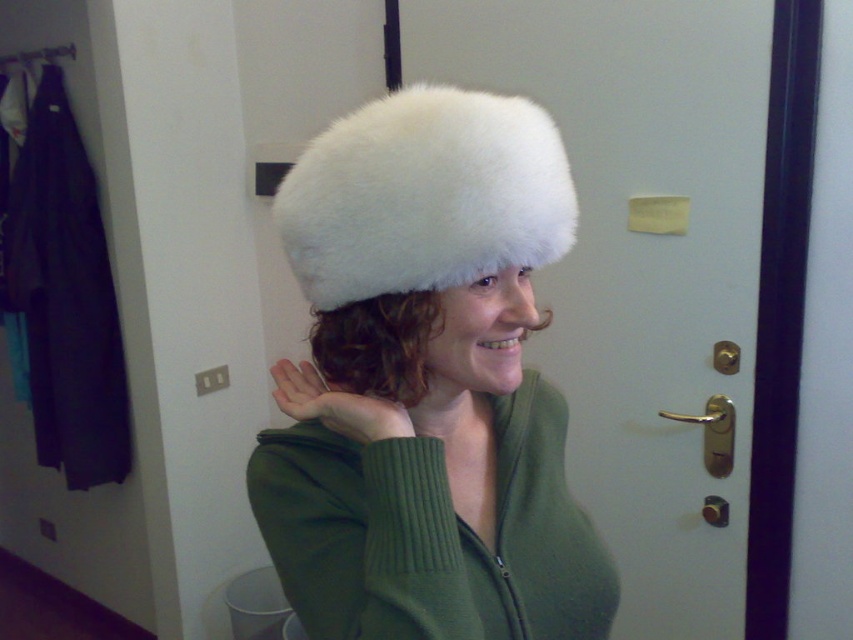
Question: Estimate the real-world distances between objects in this image. Which object is farther from the white furry hat at center?

Choices:
 (A) white fluffy hat at center
 (B) black fabric coat at left
 (C) green ribbed sweater at center

Answer: (B)

Question: Which object is positioned closest to the white furry hat at center?

Choices:
 (A) black fabric coat at left
 (B) white fluffy hat at center
 (C) green ribbed sweater at center

Answer: (C)

Question: Which is farther from the black fabric coat at left?

Choices:
 (A) green ribbed sweater at center
 (B) white furry hat at center

Answer: (A)

Question: From the image, what is the correct spatial relationship of white furry hat at center in relation to green ribbed sweater at center?

Choices:
 (A) above
 (B) below

Answer: (A)

Question: Is white furry hat at center above green ribbed sweater at center?

Choices:
 (A) yes
 (B) no

Answer: (A)

Question: Observing the image, what is the correct spatial positioning of white furry hat at center in reference to white fluffy hat at center?

Choices:
 (A) right
 (B) left

Answer: (A)